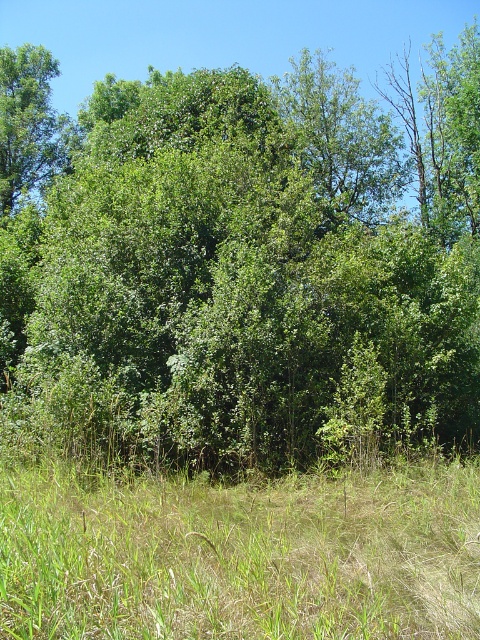
Question: Among these objects, which one is farthest from the camera?

Choices:
 (A) green leafy tree at upper left
 (B) green grassy at lower center
 (C) green leafy tree at center

Answer: (A)

Question: Among these objects, which one is farthest from the camera?

Choices:
 (A) green grassy at lower center
 (B) green leafy tree at center

Answer: (B)

Question: Does green grassy at lower center have a greater width compared to green leafy tree at upper left?

Choices:
 (A) yes
 (B) no

Answer: (A)

Question: In this image, where is green leafy tree at center located relative to green grassy at lower center?

Choices:
 (A) below
 (B) above

Answer: (B)

Question: Is green leafy tree at center closer to camera compared to green grassy at lower center?

Choices:
 (A) no
 (B) yes

Answer: (A)

Question: Which object is farther from the camera taking this photo?

Choices:
 (A) green leafy tree at upper left
 (B) green grassy at lower center

Answer: (A)